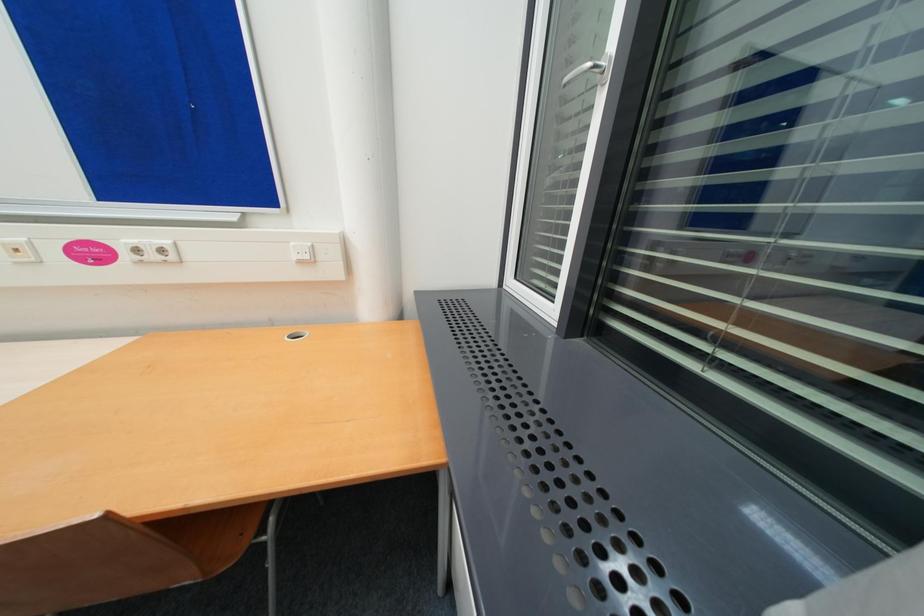
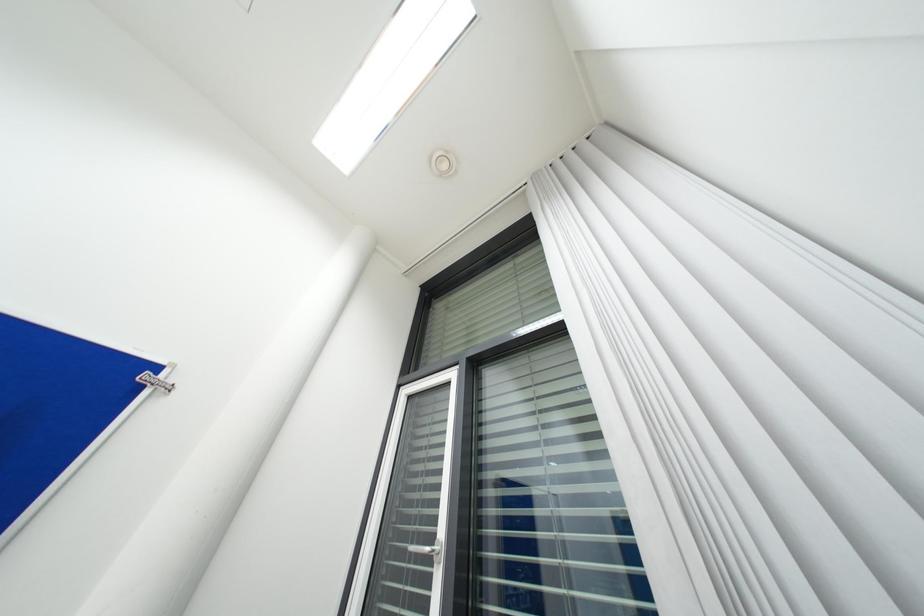
The first image is from the beginning of the video and the second image is from the end. How did the camera likely rotate when shooting the video?

The camera rotated toward right-up.